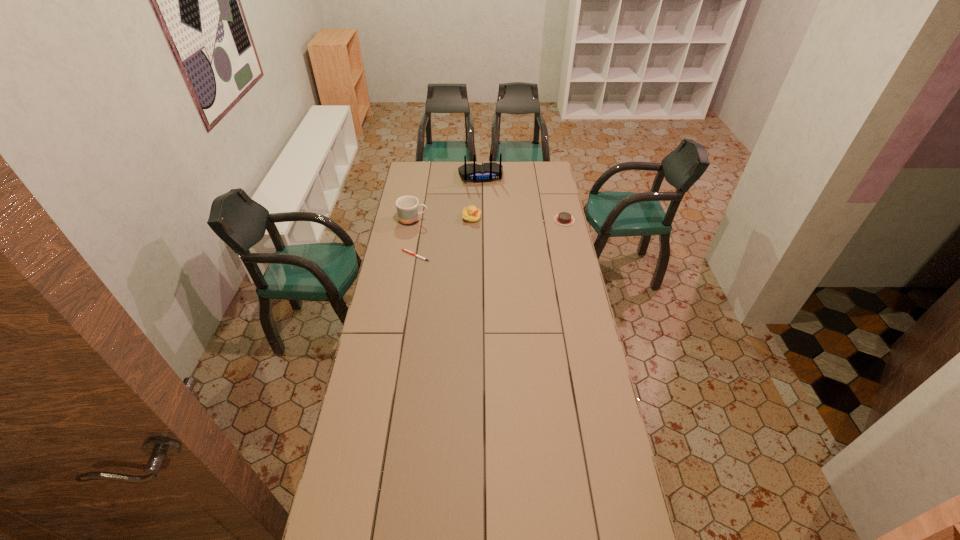
This screenshot has height=540, width=960. What are the coordinates of `unoccupied area between the second tallest object and the pen` in the screenshot? It's located at (415, 238).

The image size is (960, 540). What are the coordinates of `empty location between the tallest object and the second shortest object` in the screenshot? It's located at (522, 198).

The image size is (960, 540). I want to click on vacant region between the duckling and the mug, so click(443, 219).

Find the location of a particular element. The width and height of the screenshot is (960, 540). vacant area that lies between the duckling and the second tallest object is located at coordinates (443, 219).

Locate an element on the screen. free space that is in between the fourth tallest object and the mug is located at coordinates (489, 220).

Where is `blank region between the router and the third shortest object`? blank region between the router and the third shortest object is located at coordinates (476, 197).

Locate an element on the screen. This screenshot has width=960, height=540. empty space between the farthest object and the fourth shortest object is located at coordinates (447, 198).

The height and width of the screenshot is (540, 960). I want to click on empty space that is in between the tallest object and the pen, so click(x=448, y=216).

You are a GUI agent. You are given a task and a screenshot of the screen. Output one action in this format:
    pyautogui.click(x=<x>, y=<y>)
    Task: Click on the object that ranks as the second closest to the rightmost object
    Image resolution: width=960 pixels, height=540 pixels.
    Given the screenshot: What is the action you would take?
    pyautogui.click(x=471, y=214)

Choose which object is the nearest neighbor to the farthest object. Please provide its 2D coordinates. Your answer should be formatted as a tuple, i.e. [(x, y)], where the tuple contains the x and y coordinates of a point satisfying the conditions above.

[(471, 214)]